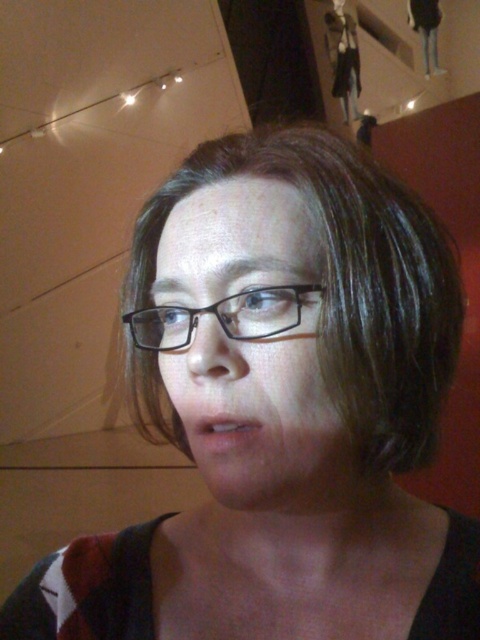
Between matte black glasses at center and black plastic glasses at center, which one is positioned lower?

Positioned lower is matte black glasses at center.

Between matte black glasses at center and black plastic glasses at center, which one has less height?

Standing shorter between the two is black plastic glasses at center.

Describe the element at coordinates (263, 419) in the screenshot. I see `matte black glasses at center` at that location.

At what (x,y) coordinates should I click in order to perform the action: click on matte black glasses at center. Please return your answer as a coordinate pair (x, y). Looking at the image, I should click on (263, 419).